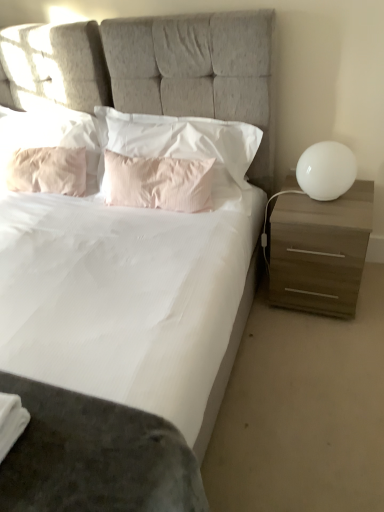
Question: Considering the relative sizes of white fabric bed at center and white glossy sphere at right in the image provided, is white fabric bed at center bigger than white glossy sphere at right?

Choices:
 (A) yes
 (B) no

Answer: (A)

Question: Could you tell me if white fabric bed at center is turned towards white glossy sphere at right?

Choices:
 (A) no
 (B) yes

Answer: (A)

Question: From the image's perspective, would you say white fabric bed at center is shown under white glossy sphere at right?

Choices:
 (A) no
 (B) yes

Answer: (B)

Question: Considering the relative sizes of white fabric bed at center and white glossy sphere at right in the image provided, is white fabric bed at center wider than white glossy sphere at right?

Choices:
 (A) no
 (B) yes

Answer: (B)

Question: Considering the relative positions of white fabric bed at center and white glossy sphere at right in the image provided, is white fabric bed at center behind white glossy sphere at right?

Choices:
 (A) yes
 (B) no

Answer: (B)

Question: Considering the positions of pink fabric pillow at upper left, arranged as the third pillow when viewed from the right, and pink satin pillow at center, the 3th pillow in the left-to-right sequence, in the image, is pink fabric pillow at upper left, arranged as the third pillow when viewed from the right, bigger or smaller than pink satin pillow at center, the 3th pillow in the left-to-right sequence,?

Choices:
 (A) big
 (B) small

Answer: (A)

Question: From a real-world perspective, is pink fabric pillow at upper left, placed as the second pillow when sorted from left to right, positioned above or below pink satin pillow at center, marked as the 2th pillow in a right-to-left arrangement?

Choices:
 (A) above
 (B) below

Answer: (A)

Question: In the image, is pink fabric pillow at upper left, placed as the second pillow when sorted from left to right, on the left side or the right side of pink satin pillow at center, marked as the 2th pillow in a right-to-left arrangement?

Choices:
 (A) right
 (B) left

Answer: (B)

Question: Is pink fabric pillow at upper left, arranged as the third pillow when viewed from the right, taller or shorter than pink satin pillow at center, marked as the 2th pillow in a right-to-left arrangement?

Choices:
 (A) short
 (B) tall

Answer: (B)

Question: Is pink satin pillow at center, the 3th pillow in the left-to-right sequence, in front of or behind pink cotton pillow at center, arranged as the 1th pillow when viewed from the right, in the image?

Choices:
 (A) front
 (B) behind

Answer: (B)

Question: Considering the positions of pink satin pillow at center, marked as the 2th pillow in a right-to-left arrangement, and pink cotton pillow at center, which appears as the fourth pillow when viewed from the left, in the image, is pink satin pillow at center, marked as the 2th pillow in a right-to-left arrangement, bigger or smaller than pink cotton pillow at center, which appears as the fourth pillow when viewed from the left,?

Choices:
 (A) small
 (B) big

Answer: (A)

Question: Do you think pink satin pillow at center, the 3th pillow in the left-to-right sequence, is within pink cotton pillow at center, which appears as the fourth pillow when viewed from the left, or outside of it?

Choices:
 (A) inside
 (B) outside

Answer: (A)

Question: From the image's perspective, is pink satin pillow at center, marked as the 2th pillow in a right-to-left arrangement, located above or below pink cotton pillow at center, which appears as the fourth pillow when viewed from the left?

Choices:
 (A) above
 (B) below

Answer: (B)

Question: From a real-world perspective, is pink satin pillow at center, marked as the 2th pillow in a right-to-left arrangement, physically located above or below white glossy sphere at right?

Choices:
 (A) above
 (B) below

Answer: (B)

Question: Is pink satin pillow at center, the 3th pillow in the left-to-right sequence, wider or thinner than white glossy sphere at right?

Choices:
 (A) wide
 (B) thin

Answer: (B)